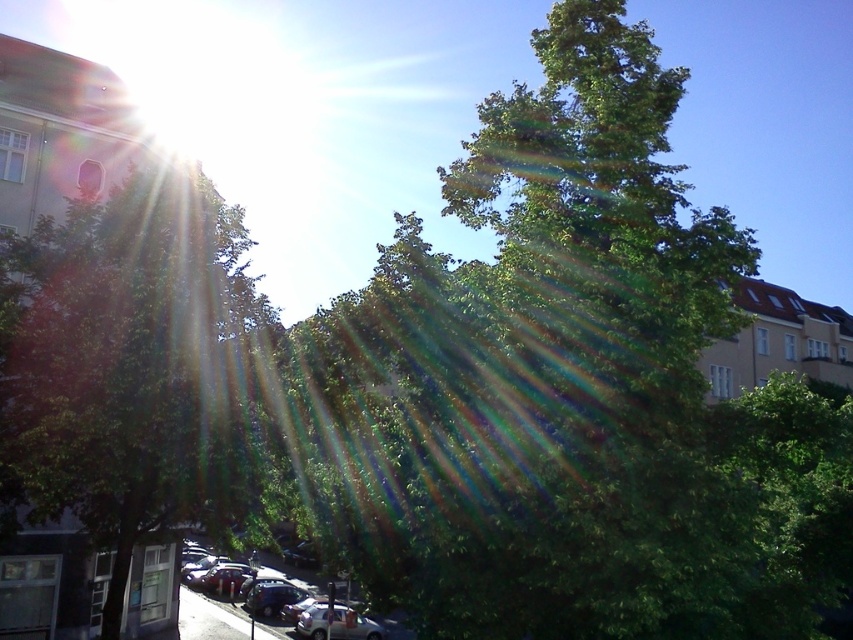
You are a delivery person trying to park your 2.5 meter wide truck. You see the green leafy tree at center and the shiny silver car at lower center. Can you fit your truck between them?

The green leafy tree at center might be wider than shiny silver car at lower center, so it is uncertain if the truck can fit between them without hitting the tree or the car.

You are a delivery drone flying over an urban street. You need to deliver a package to a location between the green leafy tree at center and the green leafy tree at left. Which tree should you use as a reference point for your delivery location because it is larger?

The green leafy tree at center is bigger than the green leafy tree at left, so you should use the green leafy tree at center as the reference point for your delivery location because it is larger.